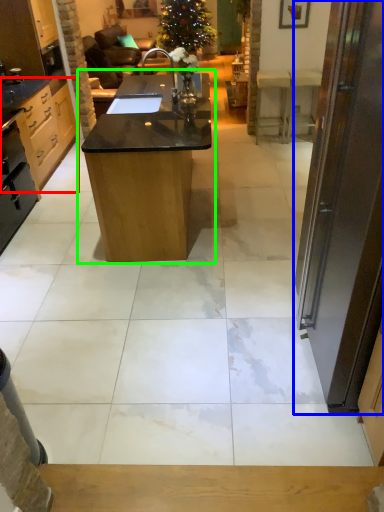
Question: Considering the real-world distances, which object is farthest from cabinetry (highlighted by a red box)? door (highlighted by a blue box) or table (highlighted by a green box)?

Choices:
 (A) door
 (B) table

Answer: (A)